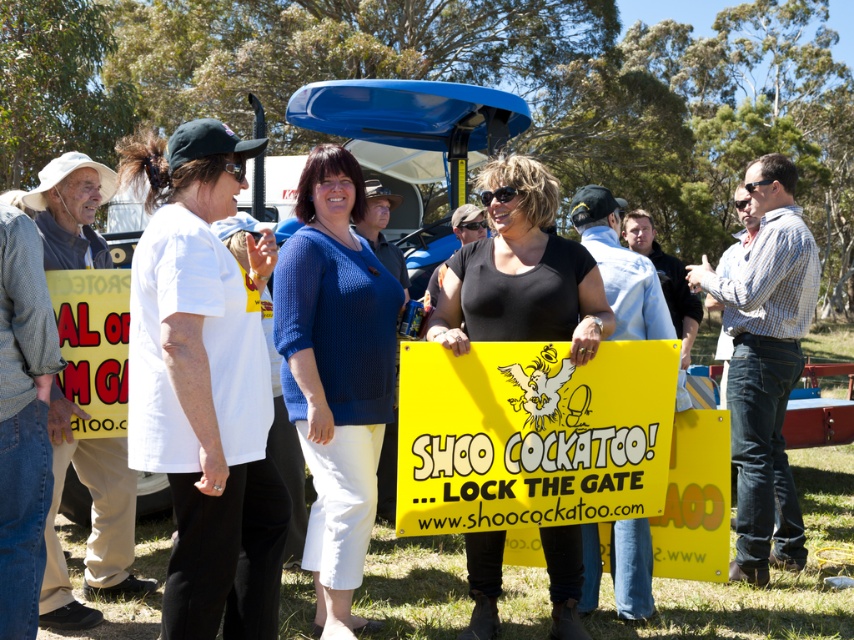
Question: Based on their relative distances, which object is nearer to the blue knitted sweater at center?

Choices:
 (A) black matte shirt at center
 (B) yellow plastic sign at center
 (C) yellow paper sign at center
 (D) white fabric shirt at left

Answer: (D)

Question: Does yellow plastic sign at center appear on the left side of blue knitted sweater at center?

Choices:
 (A) yes
 (B) no

Answer: (B)

Question: Estimate the real-world distances between objects in this image. Which object is farther from the blue knitted sweater at center?

Choices:
 (A) yellow paper sign at center
 (B) white fabric shirt at left
 (C) yellow plastic sign at center
 (D) black matte shirt at center

Answer: (A)

Question: Which object is positioned closest to the yellow paper sign at center?

Choices:
 (A) yellow plastic sign at center
 (B) black matte shirt at center
 (C) white fabric shirt at left

Answer: (C)

Question: Does white fabric shirt at left have a smaller size compared to yellow plastic sign at center?

Choices:
 (A) no
 (B) yes

Answer: (A)

Question: Does yellow plastic sign at center have a smaller size compared to black matte shirt at center?

Choices:
 (A) no
 (B) yes

Answer: (B)